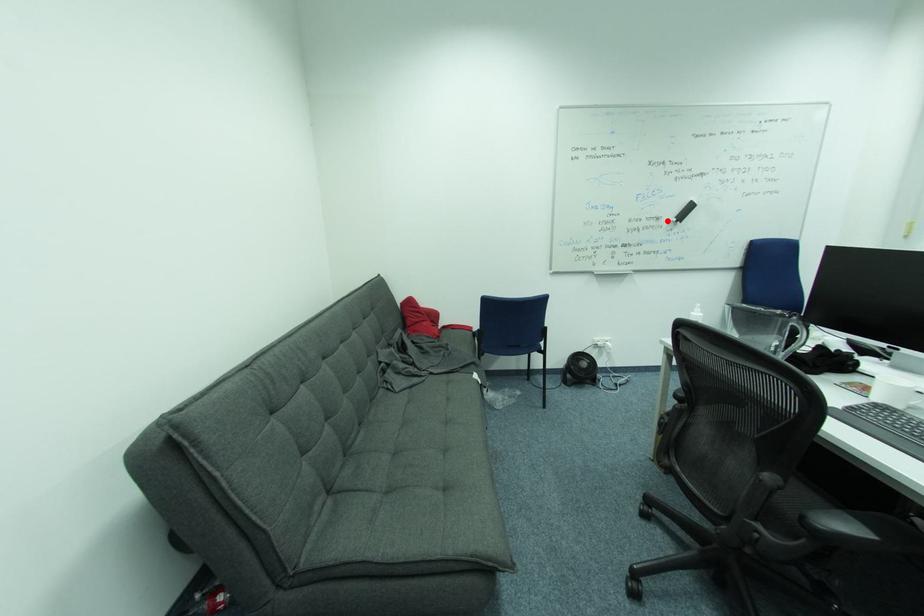
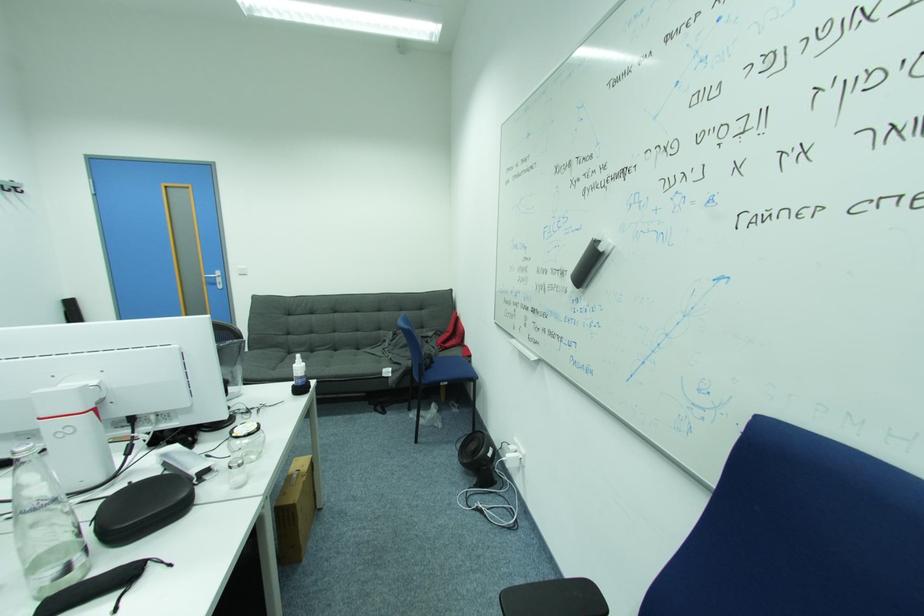
The point at the highlighted location is marked in the first image. Where is the corresponding point in the second image?

(572, 277)